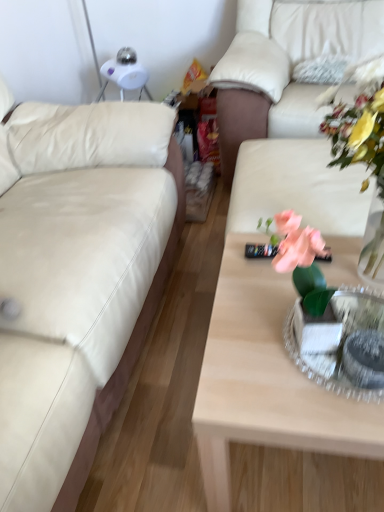
The image size is (384, 512). Find the location of `free point below translucent glass vase at upper right (from a real-world perspective)`. free point below translucent glass vase at upper right (from a real-world perspective) is located at coordinates (349, 259).